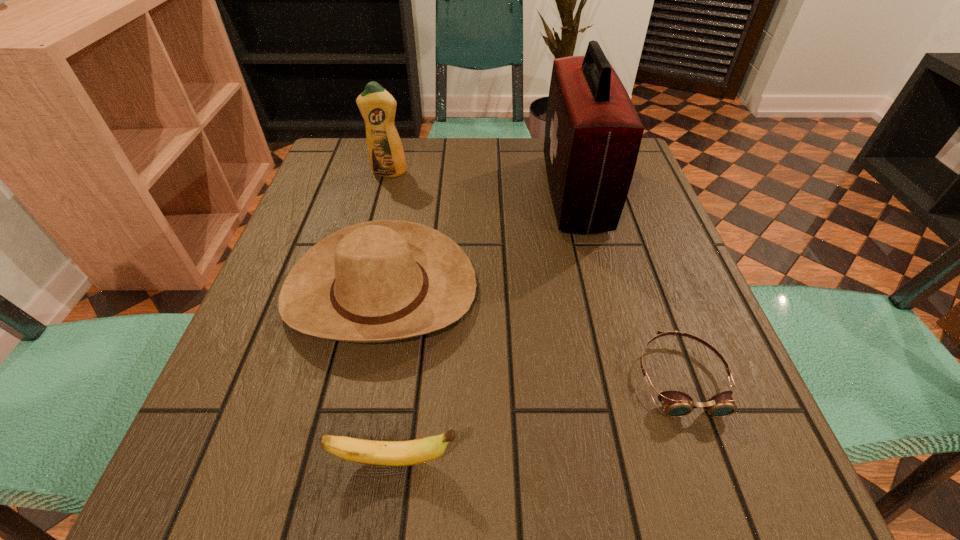
Image resolution: width=960 pixels, height=540 pixels. In order to click on free spot between the shortest object and the first aid kit in this screenshot , I will do `click(628, 285)`.

Locate an element on the screen. Image resolution: width=960 pixels, height=540 pixels. empty space that is in between the shortest object and the first aid kit is located at coordinates (628, 285).

I want to click on free space between the shortest object and the fourth shortest object, so 535,275.

Where is `vacant space that's between the goggles and the first aid kit`? vacant space that's between the goggles and the first aid kit is located at coordinates (628, 285).

You are a GUI agent. You are given a task and a screenshot of the screen. Output one action in this format:
    pyautogui.click(x=<x>, y=<y>)
    Task: Click on the vacant region between the goggles and the second shortest object
    
    Given the screenshot: What is the action you would take?
    pyautogui.click(x=538, y=419)

Locate an element on the screen. Image resolution: width=960 pixels, height=540 pixels. object that stands as the fourth closest to the second tallest object is located at coordinates (412, 452).

You are a GUI agent. You are given a task and a screenshot of the screen. Output one action in this format:
    pyautogui.click(x=<x>, y=<y>)
    Task: Click on the object that is the closest to the goggles
    The image size is (960, 540).
    Given the screenshot: What is the action you would take?
    pyautogui.click(x=378, y=281)

In order to click on free spot that satisfies the following two spatial constraints: 1. on the side of the first aid kit with the cross symbol; 2. on the front-facing side of the cowboy hat in this screenshot , I will do `click(600, 291)`.

You are a GUI agent. You are given a task and a screenshot of the screen. Output one action in this format:
    pyautogui.click(x=<x>, y=<y>)
    Task: Click on the vacant space that satisfies the following two spatial constraints: 1. on the side of the first aid kit with the cross symbol; 2. on the front-facing side of the cowboy hat
    
    Given the screenshot: What is the action you would take?
    pyautogui.click(x=600, y=291)